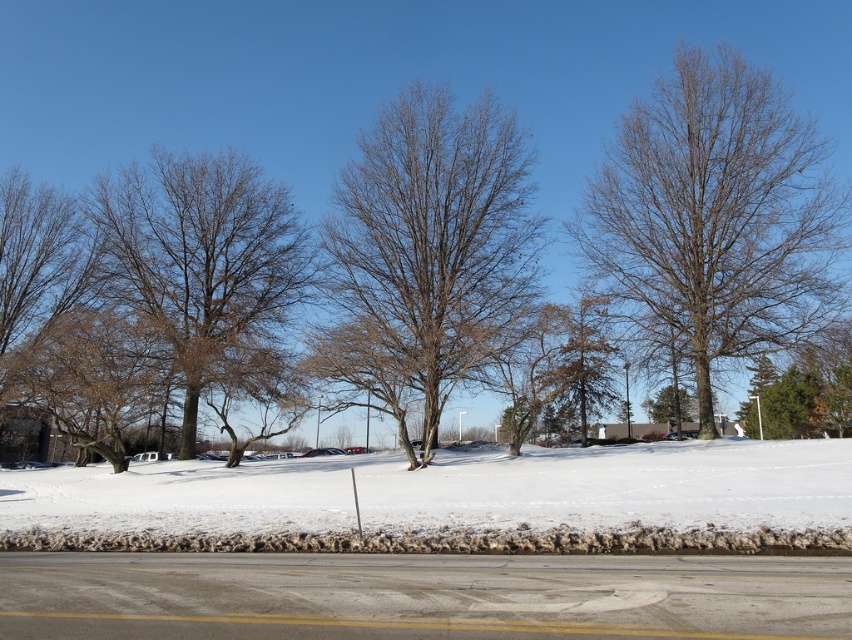
Does point (672, 499) lie in front of point (504, 253)?

Yes, point (672, 499) is closer to viewer.

Looking at this image, can you confirm if white powdery snow at center is positioned to the left of bare branches at center?

Yes, white powdery snow at center is to the left of bare branches at center.

Describe the element at coordinates (453, 502) in the screenshot. I see `white powdery snow at center` at that location.

At what (x,y) coordinates should I click in order to perform the action: click on white powdery snow at center. Please return your answer as a coordinate pair (x, y). The image size is (852, 640). Looking at the image, I should click on (453, 502).

Who is positioned more to the left, white powdery snow at center or bare branches at upper right?

white powdery snow at center

Measure the distance between white powdery snow at center and camera.

white powdery snow at center is 9.59 meters away from camera.

Who is more distant from viewer, [217,492] or [645,152]?

The point [645,152] is behind.

Locate an element on the screen. This screenshot has height=640, width=852. white powdery snow at center is located at coordinates (453, 502).

Is bare branches at center to the right of bare brown tree at left from the viewer's perspective?

Yes, bare branches at center is to the right of bare brown tree at left.

What do you see at coordinates (435, 237) in the screenshot? I see `bare branches at center` at bounding box center [435, 237].

Identify the location of bare branches at center. (435, 237).

Where is `bare branches at center`? bare branches at center is located at coordinates (435, 237).